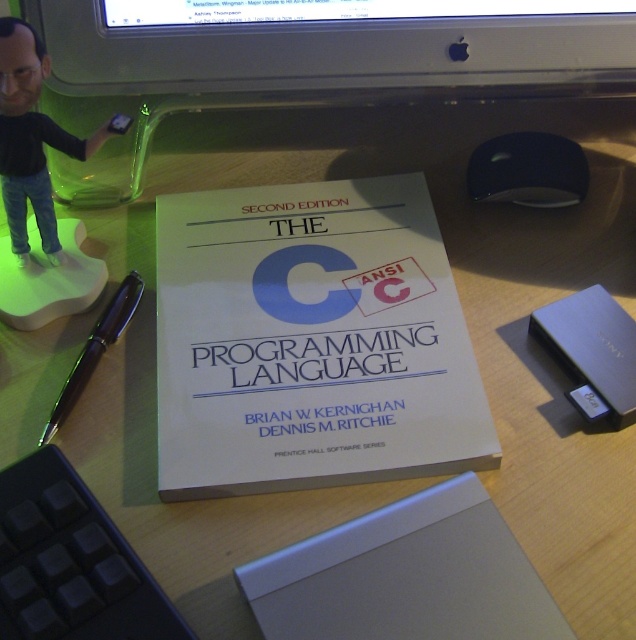
Question: From the image, what is the correct spatial relationship of black plastic keyboard at lower left in relation to silver metallic laptop at lower right?

Choices:
 (A) left
 (B) right

Answer: (A)

Question: Estimate the real-world distances between objects in this image. Which object is farther from the silver metallic laptop at lower right?

Choices:
 (A) black glossy pen at left
 (B) silver metallic laptop at center

Answer: (A)

Question: Considering the real-world distances, which object is closest to the black glossy pen at left?

Choices:
 (A) silver metallic laptop at lower right
 (B) silver metallic laptop at center
 (C) black plastic figurine at upper left

Answer: (C)

Question: Can you confirm if black plastic figurine at upper left is bigger than silver metallic laptop at lower right?

Choices:
 (A) no
 (B) yes

Answer: (B)

Question: Is silver metallic laptop at center bigger than silver metallic laptop at lower right?

Choices:
 (A) no
 (B) yes

Answer: (B)

Question: Among these objects, which one is farthest from the camera?

Choices:
 (A) silver metallic laptop at center
 (B) black plastic figurine at upper left

Answer: (B)